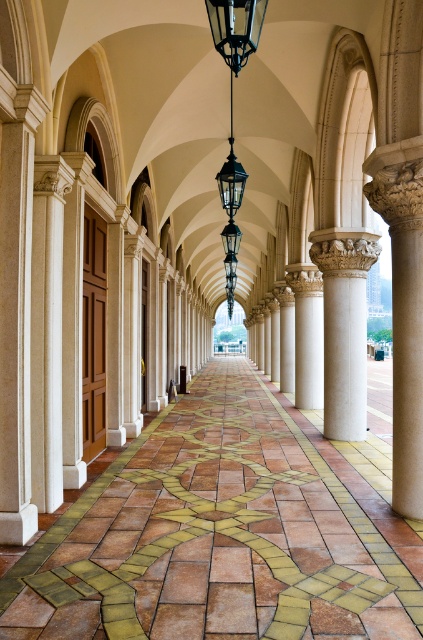
You are a maintenance worker needing to reach the black metal lantern at upper center from the brown tile floor at center. The ladder you have is 18 feet long. Can you safely reach the lantern with your ladder?

The distance between the brown tile floor at center and the black metal lantern at upper center is 19.74 feet. Since the ladder is only 18 feet long, it is not long enough to safely reach the lantern.

You are standing in the colonnade and want to hang a new lantern above the white stone column at center. Can you see the black metal lantern at upper center from your current position?

The black metal lantern at upper center is behind the white stone column at center, so you cannot see the black metal lantern at upper center from your current position.